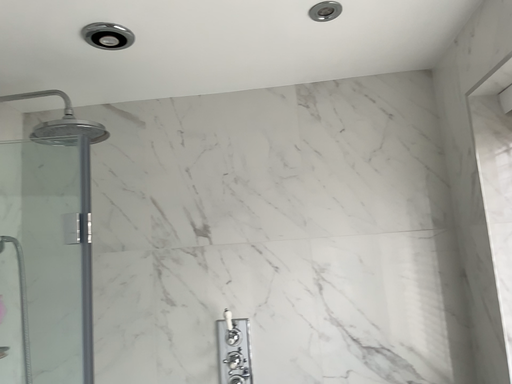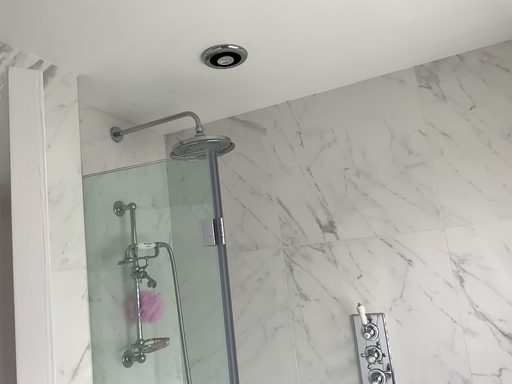
Question: How did the camera likely rotate when shooting the video?

Choices:
 (A) rotated left
 (B) rotated right

Answer: (A)